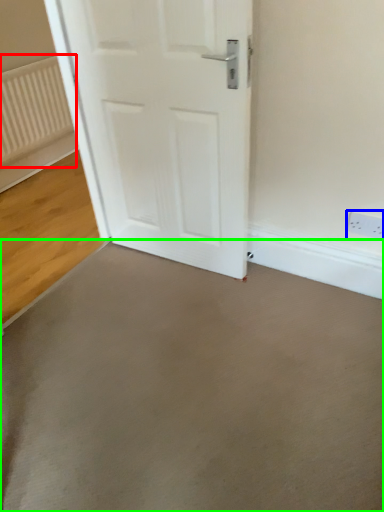
Question: Based on their relative distances, which object is farther from radiator (highlighted by a red box)? Choose from electric outlet (highlighted by a blue box) and concrete (highlighted by a green box).

Choices:
 (A) electric outlet
 (B) concrete

Answer: (A)